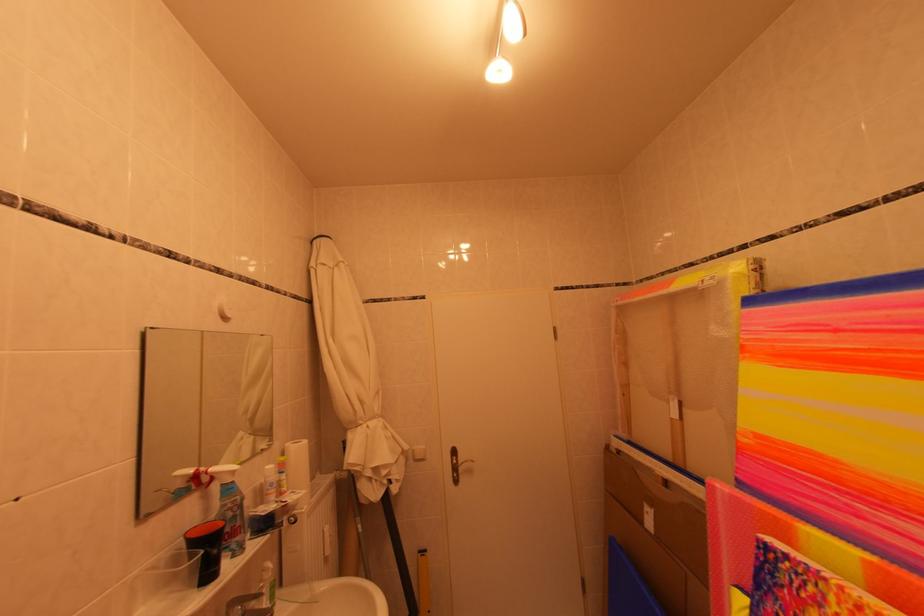
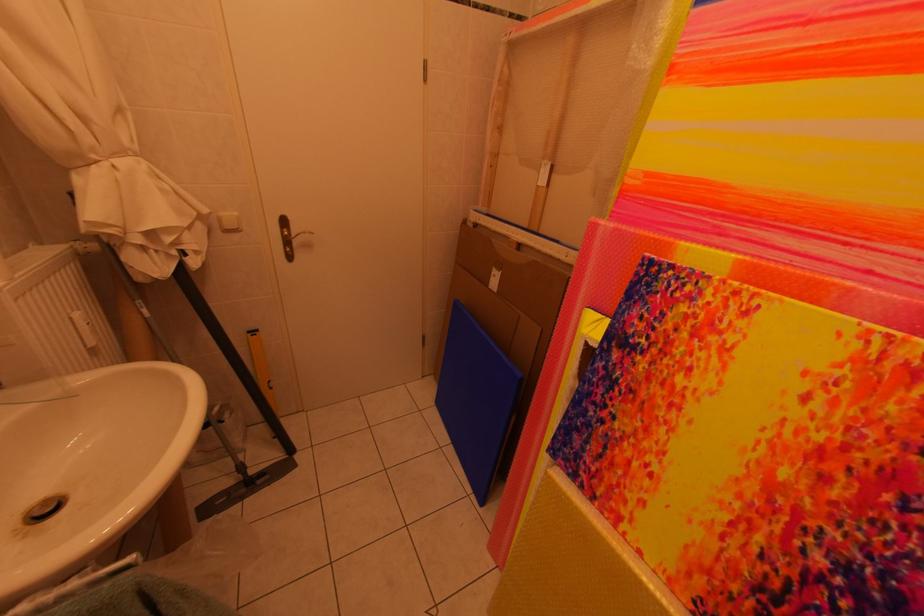
The point at (424, 451) is marked in the first image. Where is the corresponding point in the second image?

(229, 217)